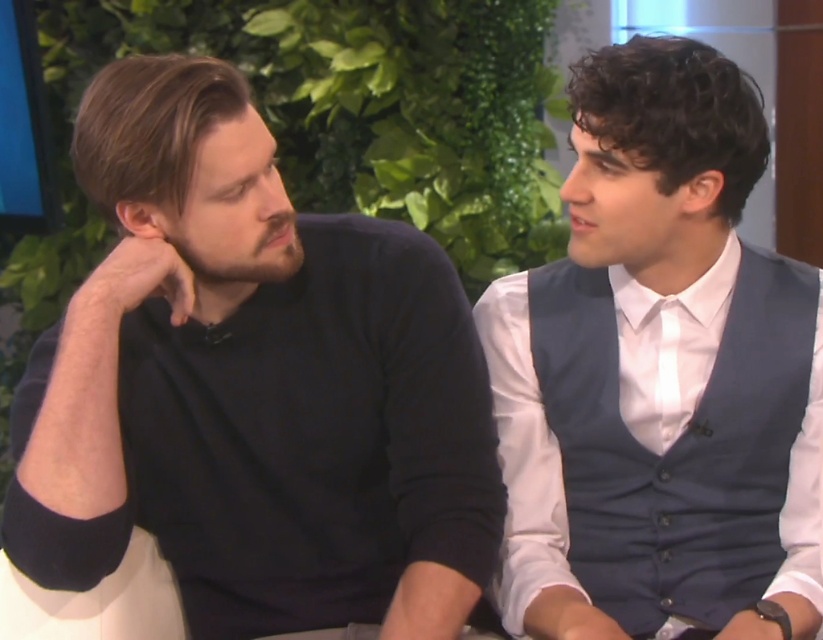
You are a photographer setting up for a group photo. You need to ensure that the two subjects, the matte black sweater at left and the white shirt with navy blue vest at right, are positioned at least 12 inches apart for proper framing. Based on the current setup, will their current distance meet your requirement?

The matte black sweater at left and the white shirt with navy blue vest at right are 13.14 inches apart from each other, which exceeds the 12 inch requirement. Their current distance meets the requirement.

You are a costume designer preparing for a photoshoot. You have two outfits to choose from for the left and right individuals in the scene. The matte black sweater at left and the white shirt with navy blue vest at right. Considering their sizes, which outfit would you recommend for someone who prefers a more oversized look?

The matte black sweater at left has a larger size compared to the white shirt with navy blue vest at right, so the matte black sweater at left would be recommended for someone who prefers a more oversized look.

You are a photographer setting up for a photoshoot in the studio. You want to ensure that the matte black sweater at left and the white shirt with navy blue vest at right are both visible in the frame. Based on their positions, which clothing item should you focus on first to ensure proper lighting?

The matte black sweater at left is positioned under the white shirt with navy blue vest at right, so you should focus on the white shirt with navy blue vest at right first to ensure proper lighting since it is higher up and might be in a different lighting zone than the lower positioned matte black sweater at left.